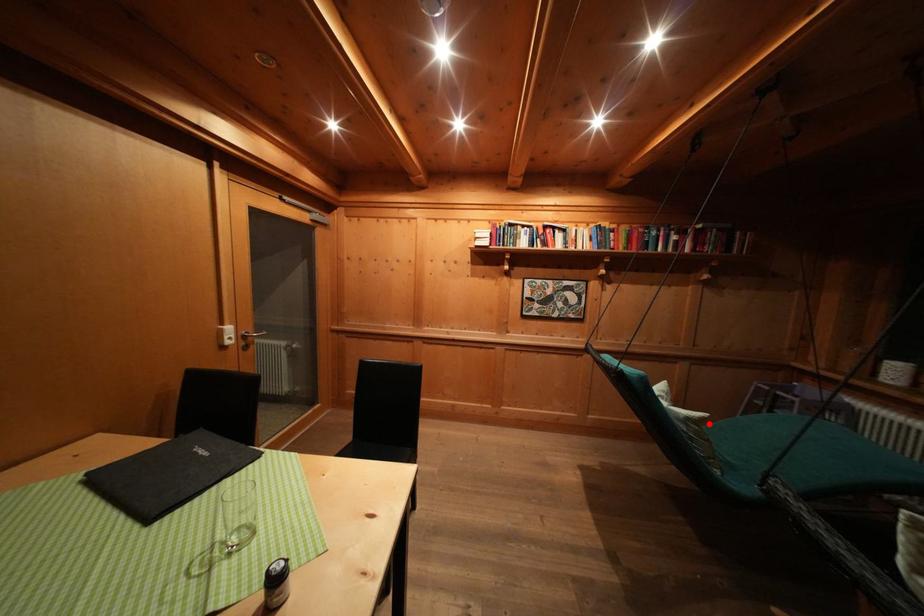
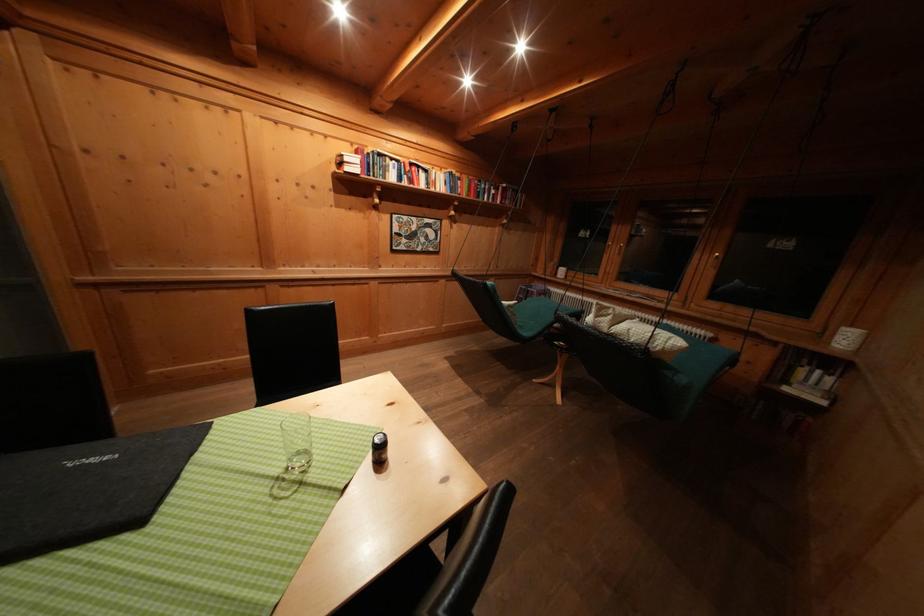
Where in the second image is the point corresponding to the highlighted location from the first image?

(520, 309)